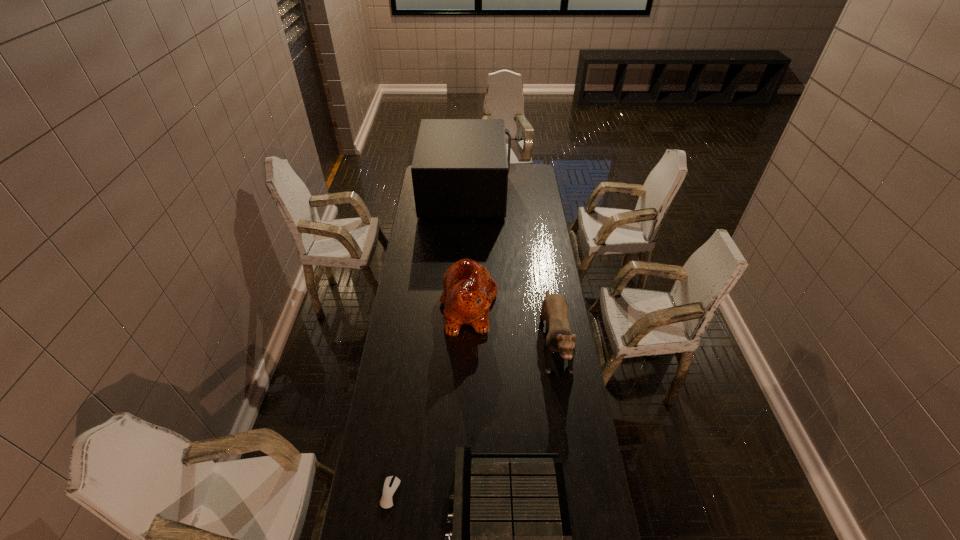
Locate an element on the screen. The width and height of the screenshot is (960, 540). the farthest object is located at coordinates (460, 168).

You are a GUI agent. You are given a task and a screenshot of the screen. Output one action in this format:
    pyautogui.click(x=<x>, y=<y>)
    Task: Click on the tallest object
    The width and height of the screenshot is (960, 540).
    Given the screenshot: What is the action you would take?
    pyautogui.click(x=460, y=168)

Identify the location of cat. (469, 290).

I want to click on ferret, so click(x=554, y=308).

Locate an element on the screen. This screenshot has height=540, width=960. mouse is located at coordinates (391, 487).

Identify the location of vacant space situated 0.070m on the front-facing side of the tallest object. (522, 192).

Identify the location of free space located on the face of the cat. 563,305.

The width and height of the screenshot is (960, 540). In order to click on vacant area situated 0.050m on the face of the ferret in this screenshot , I will do `click(564, 400)`.

Locate an element on the screen. The image size is (960, 540). vacant region located 0.380m on the right of the mouse is located at coordinates (519, 493).

Image resolution: width=960 pixels, height=540 pixels. Find the location of `object present at the far edge`. object present at the far edge is located at coordinates (460, 168).